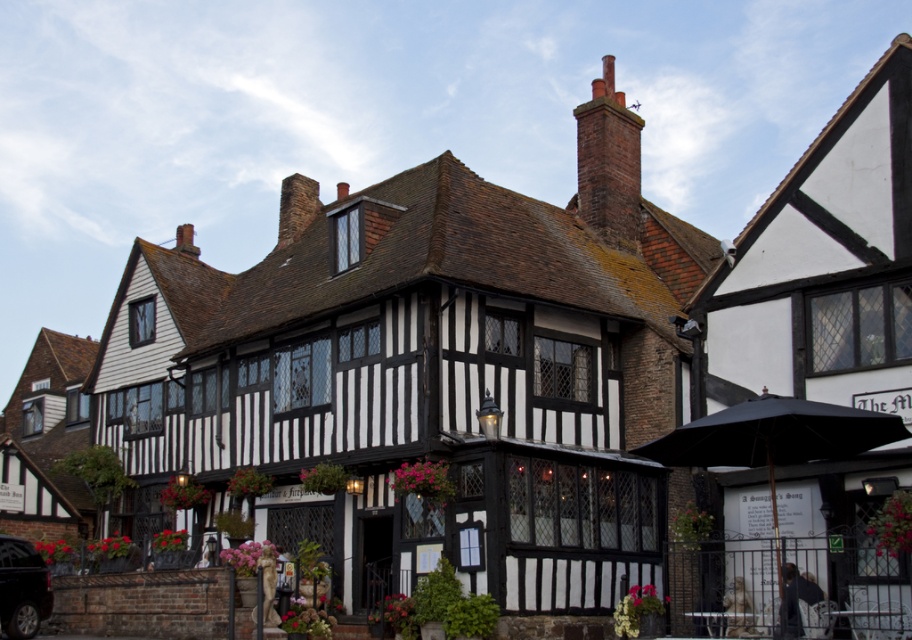
You are a delivery driver who needs to park your shiny black car at lower left as close as possible to the red brick chimney at upper center for unloading packages. Given the spatial arrangement, can you park the car directly in front of the chimney?

The red brick chimney at upper center is positioned on the right side of shiny black car at lower left, meaning the car cannot be parked directly in front of the chimney since they are aligned horizontally rather than vertically. The car would need to park to the left of the chimney to be closest to it.

You are a photographer standing in front of the half timbered building. You want to take a picture of the red brick chimney at upper center and the shiny black car at lower left. Which object will appear larger in your photo?

The red brick chimney at upper center will appear larger in the photo because it is closer to the viewer than the shiny black car at lower left.